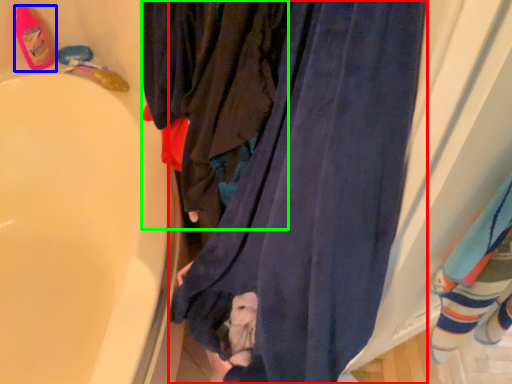
Question: Considering the real-world distances, which object is farthest from curtain (highlighted by a red box)? footwear (highlighted by a blue box) or clothing (highlighted by a green box)?

Choices:
 (A) footwear
 (B) clothing

Answer: (A)